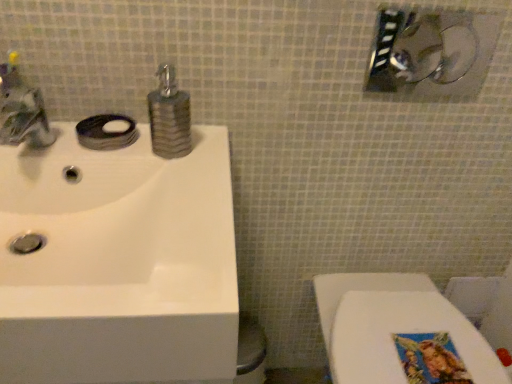
Where is `vacant space to the right of matte silver soap at sink left`? This screenshot has height=384, width=512. vacant space to the right of matte silver soap at sink left is located at coordinates (187, 150).